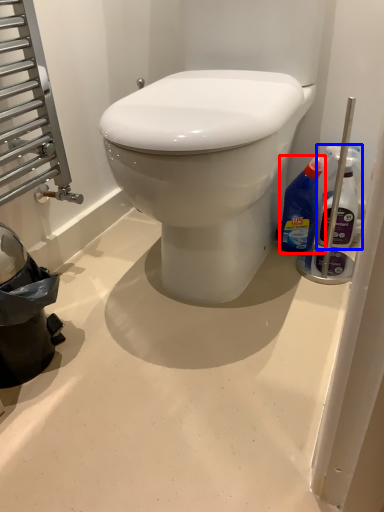
Question: Which point is closer to the camera, bottle (highlighted by a red box) or bottle (highlighted by a blue box)?

Choices:
 (A) bottle
 (B) bottle

Answer: (B)